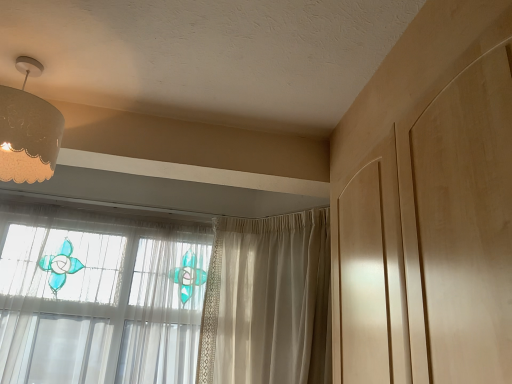
Question: Is sheer beige curtain at center situated inside matte white lampshade at upper left or outside?

Choices:
 (A) outside
 (B) inside

Answer: (A)

Question: Is sheer beige curtain at center in front of or behind matte white lampshade at upper left in the image?

Choices:
 (A) behind
 (B) front

Answer: (A)

Question: In the image, is sheer beige curtain at center on the left side or the right side of matte white lampshade at upper left?

Choices:
 (A) left
 (B) right

Answer: (B)

Question: From the image's perspective, relative to sheer beige curtain at center, is matte white lampshade at upper left above or below?

Choices:
 (A) above
 (B) below

Answer: (A)

Question: Is matte white lampshade at upper left in front of or behind sheer beige curtain at center in the image?

Choices:
 (A) behind
 (B) front

Answer: (B)

Question: Is matte white lampshade at upper left spatially inside sheer beige curtain at center, or outside of it?

Choices:
 (A) outside
 (B) inside

Answer: (A)

Question: Considering the positions of point (16, 130) and point (240, 221), is point (16, 130) closer or farther from the camera than point (240, 221)?

Choices:
 (A) farther
 (B) closer

Answer: (B)